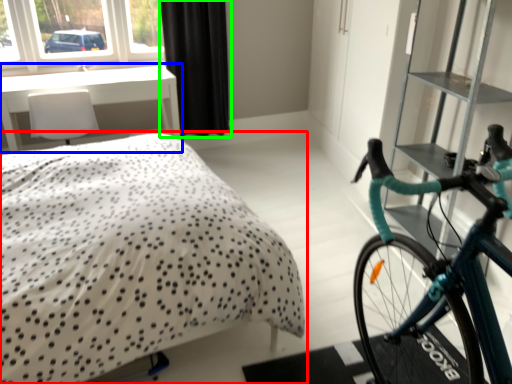
Question: Estimate the real-world distances between objects in this image. Which object is farther from bed (highlighted by a red box), table (highlighted by a blue box) or curtain (highlighted by a green box)?

Choices:
 (A) table
 (B) curtain

Answer: (B)